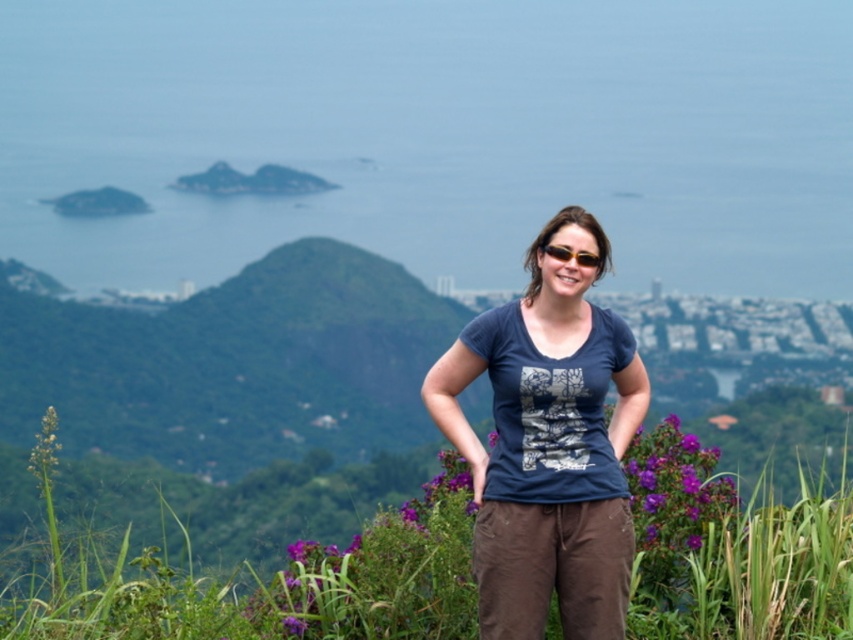
You are standing at the point labeled as point (550, 552) in the image. You want to take a photo of the person in the center using a camera that has a 50mm lens. The camera you are using has a focal length of 50mm. The recommended distance for taking a clear photo of a person with this lens is between 3 and 6 meters. Will you be able to take a clear photo of the person in the center from your current position?

The distance between point (550, 552) and the camera is 11.06 meters. Since the recommended distance for a clear photo with a 50mm lens is between 3 and 6 meters, you are currently 11.06 meters away, which is outside the recommended range. Therefore, you will not be able to take a clear photo of the person in the center from your current position.

From the picture: You are standing in the scenic outdoor setting shown in the image. You notice two points marked in the scene. The first point is at coordinates point (492, 621), and the second point is at coordinates point (634, 449). Which of these two points is closer to you?

Point (492, 621) is in front of point (634, 449), so it is closer to you.